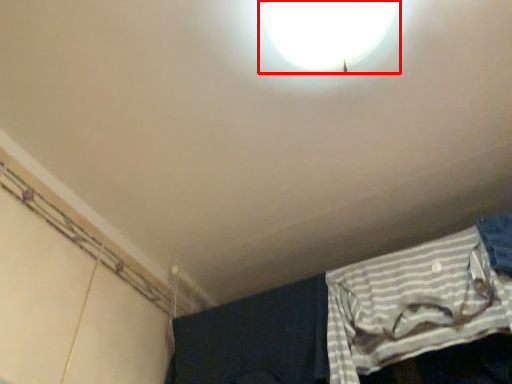
Question: In this image, where is lamp (annotated by the red box) located relative to curtain?

Choices:
 (A) left
 (B) right

Answer: (A)